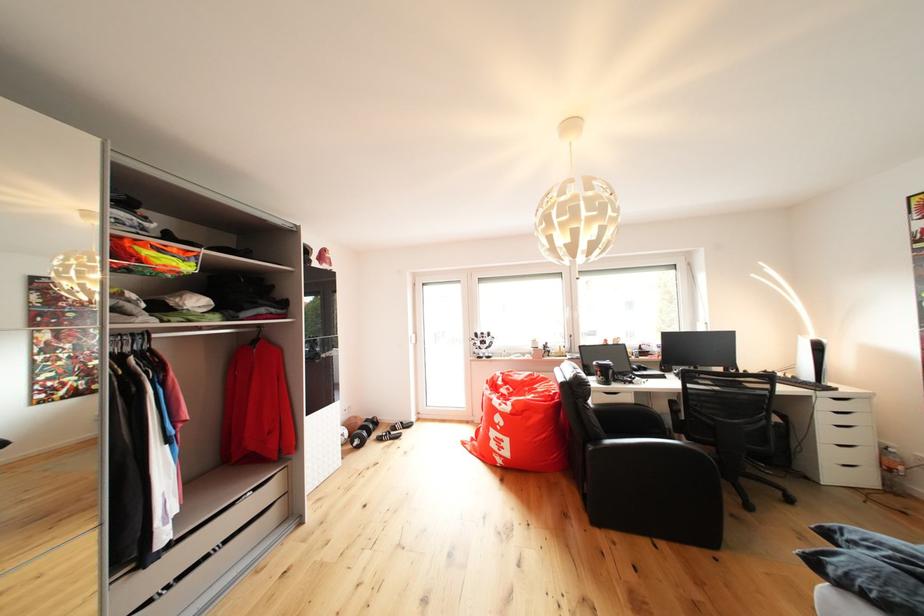
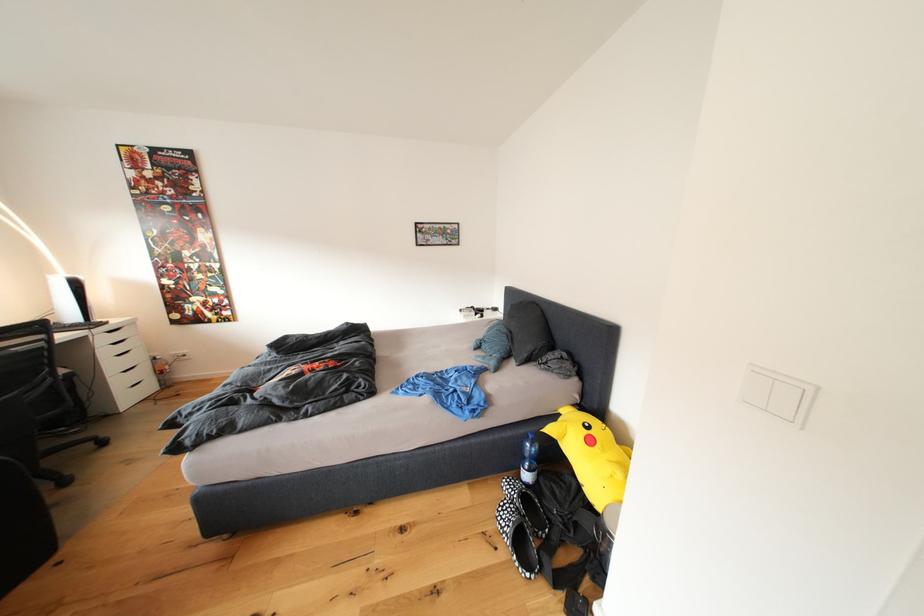
Where in the second image is the point corresponding to point (822, 342) from the first image?

(76, 281)